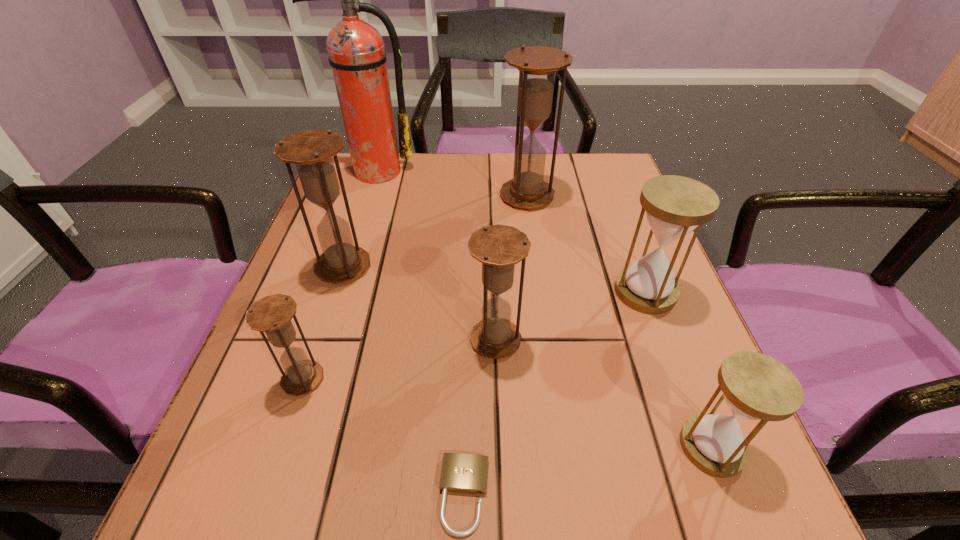
This screenshot has width=960, height=540. What are the coordinates of `fire extinguisher` in the screenshot? It's located at pos(356,52).

This screenshot has width=960, height=540. In order to click on the tallest hourglass in this screenshot , I will do `click(537, 66)`.

What are the coordinates of `the farthest hourglass` in the screenshot? It's located at (537, 66).

Identify the location of the fifth shortest hourglass. (311, 151).

Locate an element on the screen. This screenshot has width=960, height=540. the second biggest brown hourglass is located at coordinates (311, 151).

I want to click on the second nearest brown hourglass, so click(498, 247).

The image size is (960, 540). What are the coordinates of `the second smallest brown hourglass` in the screenshot? It's located at (498, 247).

Image resolution: width=960 pixels, height=540 pixels. In order to click on the farther white hourglass in this screenshot , I will do `click(675, 205)`.

What are the coordinates of `the sixth farthest object` in the screenshot? It's located at (272, 314).

Locate an element on the screen. This screenshot has height=540, width=960. the fifth farthest hourglass is located at coordinates (272, 314).